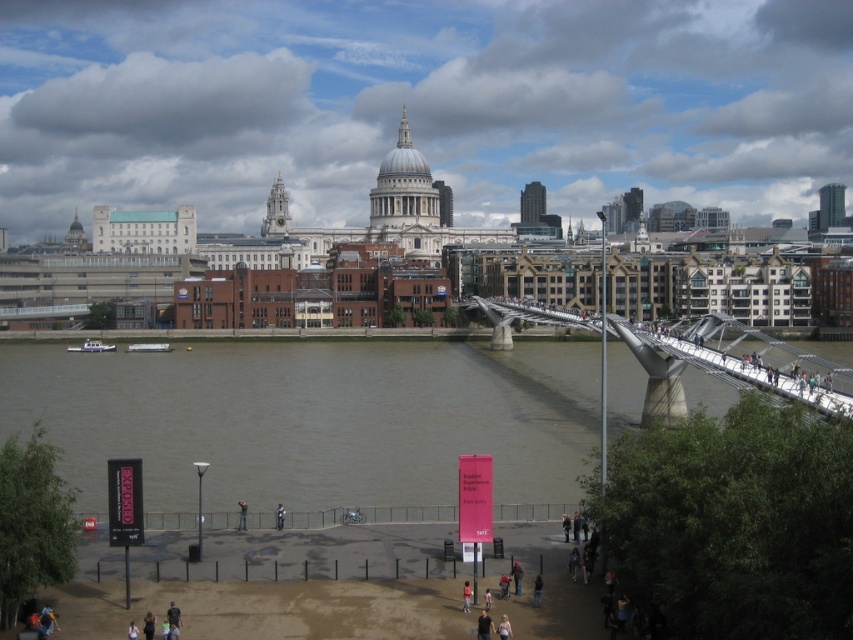
You are a tourist standing on the riverside walkway on the left side of the image. You want to cross the river to reach the Millennium Bridge. Given that the distance between the brown water at lower center and the metallic gray bridge at center right is 16.40 meters, can you safely walk across the brown water to reach the bridge?

The brown water at lower center is 16.40 meters away from the metallic gray bridge at center right. However, the water might be too deep or fast to walk across safely. It is recommended to use the Millennium Bridge instead for safe passage.